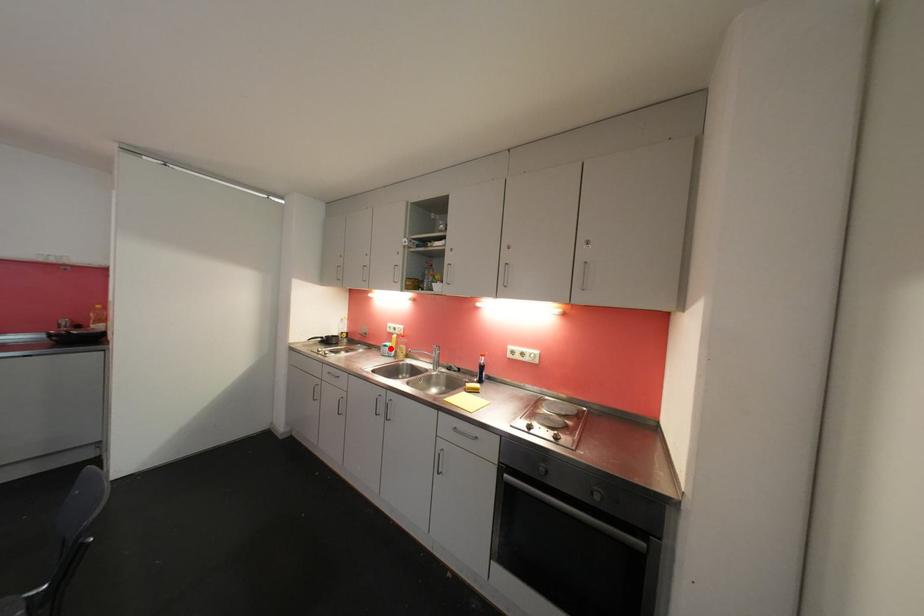
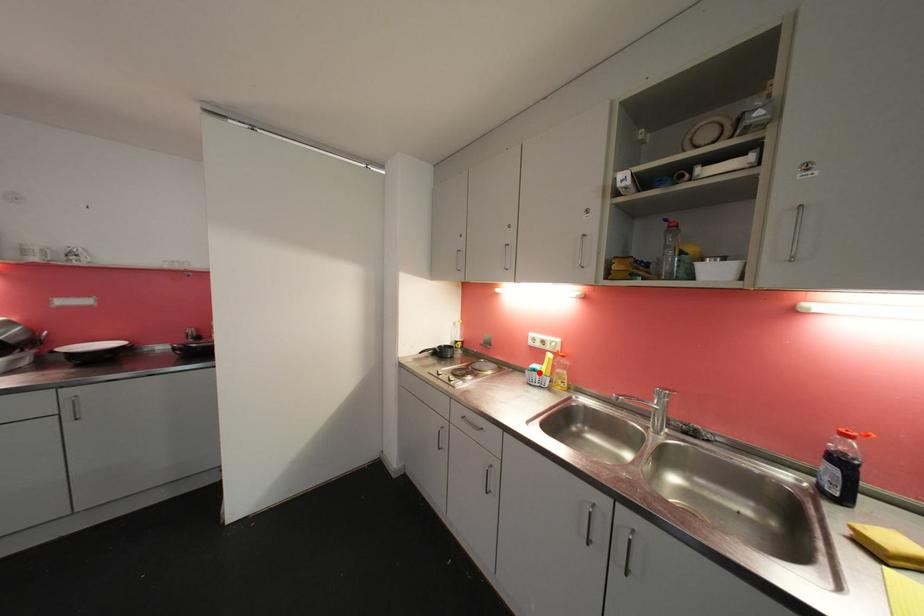
I am providing you with two images of the same scene from different viewpoints. A red point is marked on the first image and another point is marked on the second image. Does the point marked in image1 correspond to the same location as the one in image2?

Yes